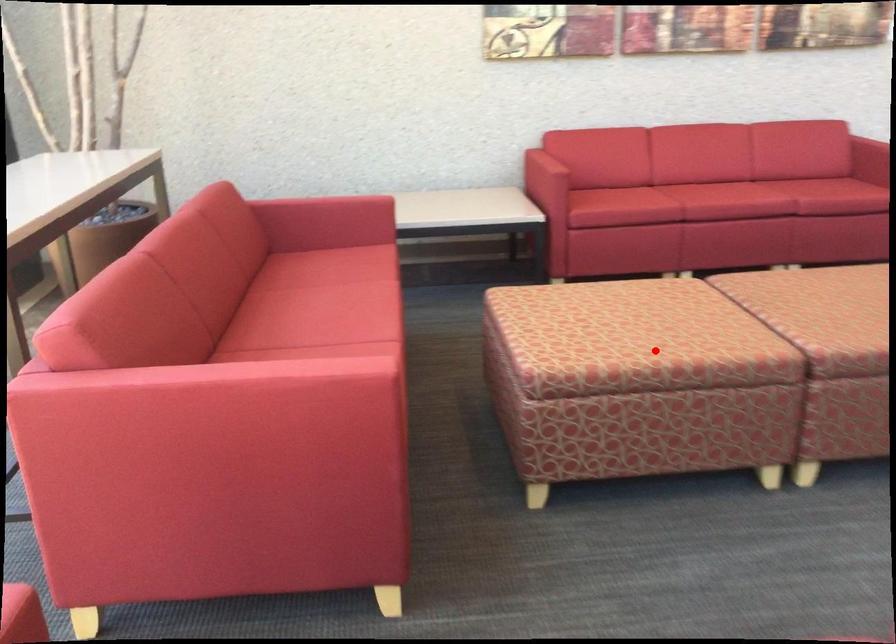
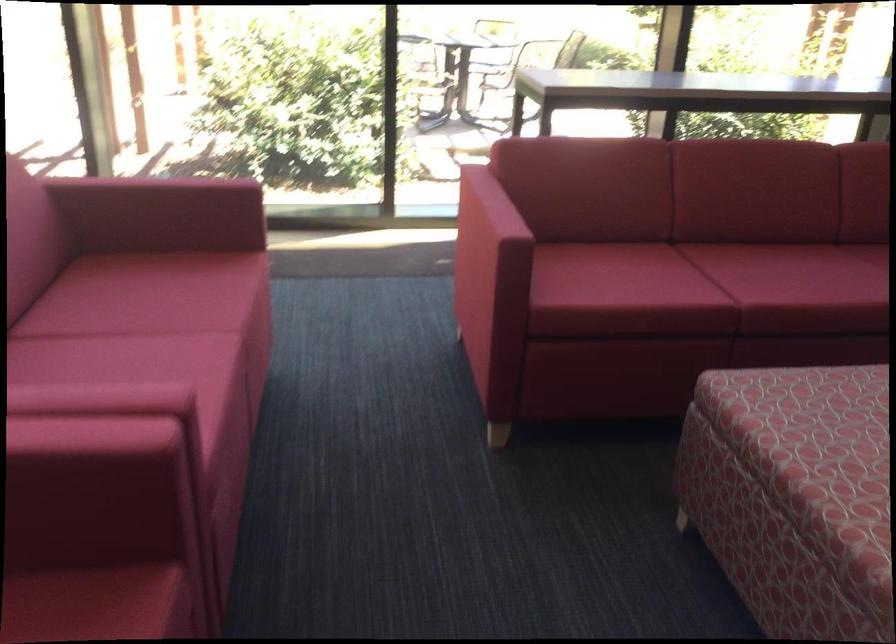
Find the pixel in the second image that matches the highlighted location in the first image.

(815, 460)